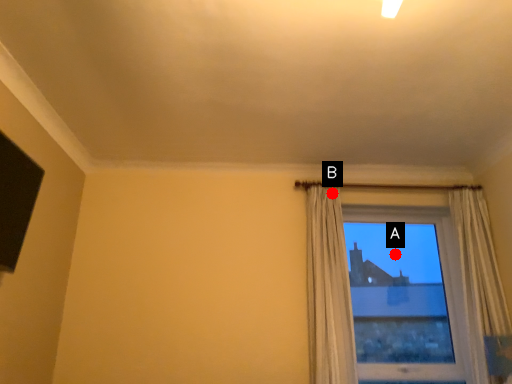
Question: Two points are circled on the image, labeled by A and B beside each circle. Which point is closer to the camera?

Choices:
 (A) A is closer
 (B) B is closer

Answer: (B)